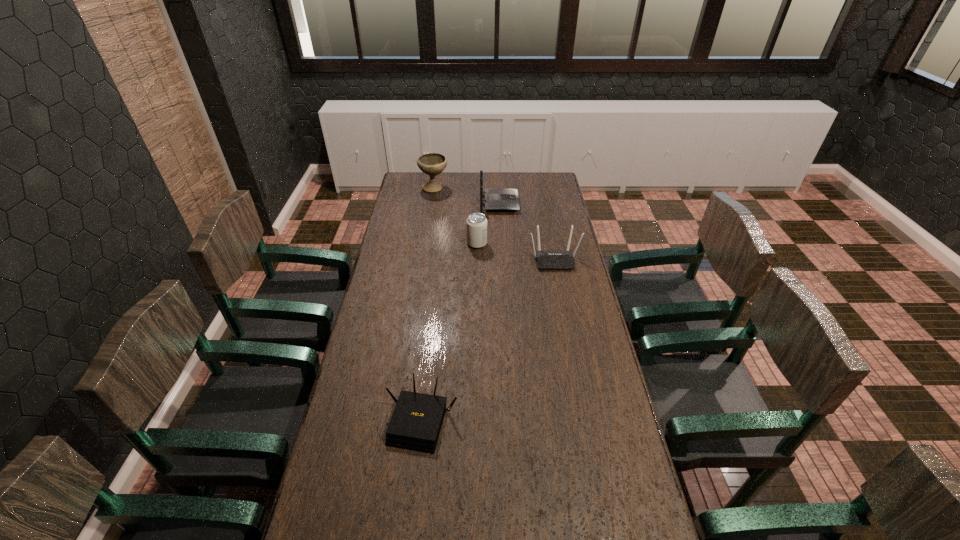
At what (x,y) coordinates should I click in order to perform the action: click on vacant space situated on the front-facing side of the second farthest router. Please return your answer as a coordinate pair (x, y). Looking at the image, I should click on (564, 312).

Find the location of a particular element. This screenshot has height=540, width=960. vacant space located 0.350m on the right of the shortest router is located at coordinates click(573, 421).

Locate an element on the screen. This screenshot has width=960, height=540. chalice at the far edge is located at coordinates tap(432, 164).

Find the location of a particular element. The height and width of the screenshot is (540, 960). router situated at the far edge is located at coordinates (496, 199).

You are a GUI agent. You are given a task and a screenshot of the screen. Output one action in this format:
    pyautogui.click(x=<x>, y=<y>)
    Task: Click on the chalice present at the left edge
    
    Given the screenshot: What is the action you would take?
    pyautogui.click(x=432, y=164)

You are a GUI agent. You are given a task and a screenshot of the screen. Output one action in this format:
    pyautogui.click(x=<x>, y=<y>)
    Task: Click on the router that is at the left edge
    The width and height of the screenshot is (960, 540).
    Given the screenshot: What is the action you would take?
    pyautogui.click(x=415, y=425)

Locate an element on the screen. The height and width of the screenshot is (540, 960). object situated at the right edge is located at coordinates (546, 260).

Locate an element on the screen. This screenshot has width=960, height=540. object that is at the far left corner is located at coordinates (432, 164).

Identify the location of vacant region at the far edge of the desktop. The image size is (960, 540). (525, 183).

The width and height of the screenshot is (960, 540). I want to click on vacant space at the left edge of the desktop, so click(x=422, y=222).